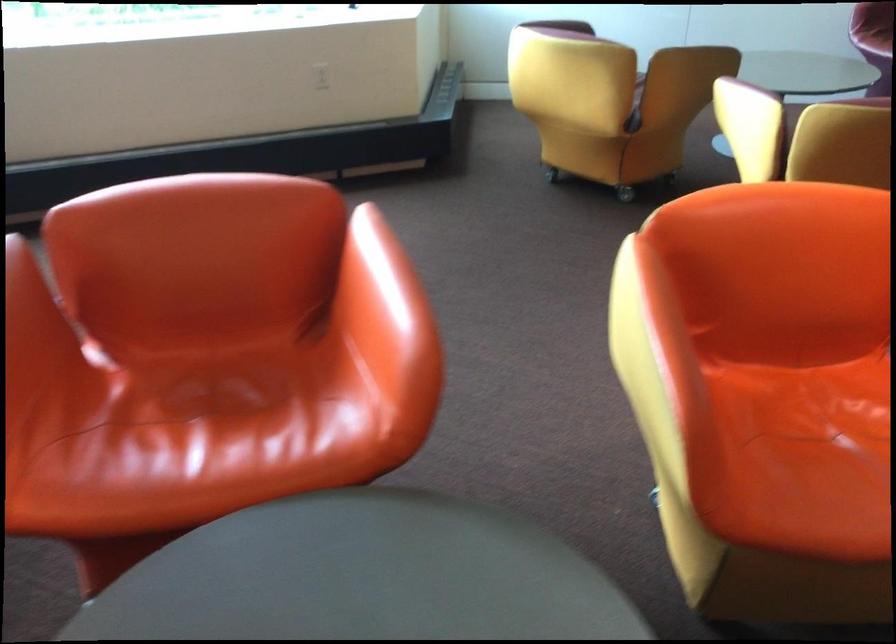
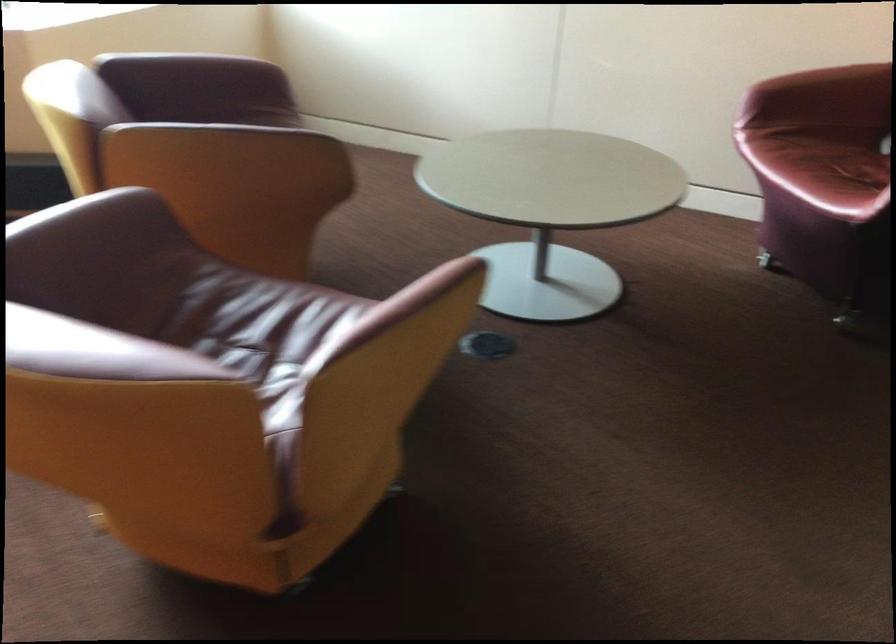
What movement of the cameraman would produce the second image?

The cameraman moved toward right, forward.